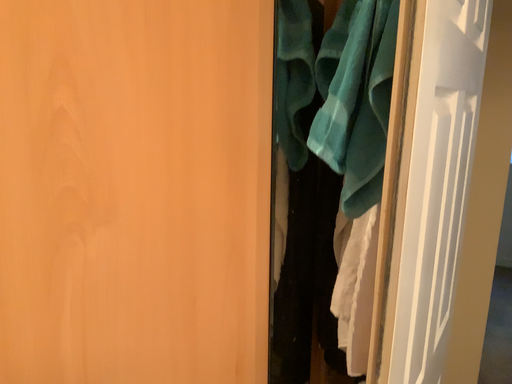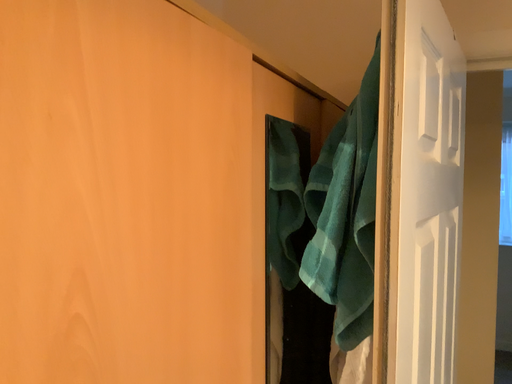
Question: How did the camera likely rotate when shooting the video?

Choices:
 (A) rotated upward
 (B) rotated downward

Answer: (A)